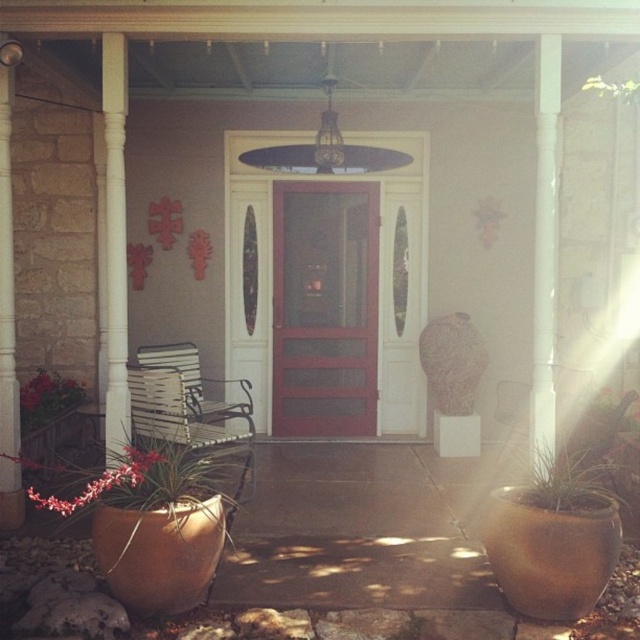
You are standing on the porch and want to place a small potted plant exactly at the point marked by the coordinates point (125,476). Is there enough space there to place it without it being obstructed by the existing objects?

The point (125,476) corresponds to the matte terracotta pot at lower left, so placing the potted plant there would obstruct the existing matte terracotta pot at lower left.

You are standing on the porch and want to place a small potted herb plant between the white painted wood column at left and the green leafy plant at lower left. Which object should you place it closer to if you want the herb plant to be near the larger object?

You should place the small potted herb plant closer to the white painted wood column at left because it is larger than the green leafy plant at lower left.